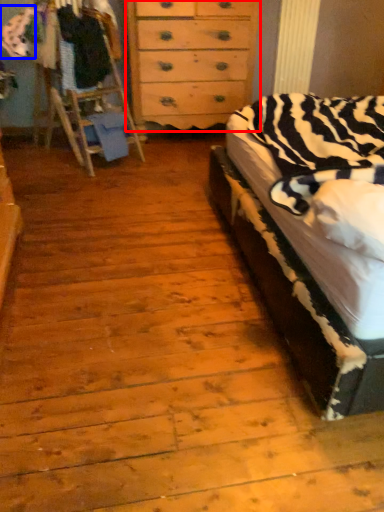
Question: Which of the following is the farthest to the observer, chest of drawers (highlighted by a red box) or clothing (highlighted by a blue box)?

Choices:
 (A) chest of drawers
 (B) clothing

Answer: (A)